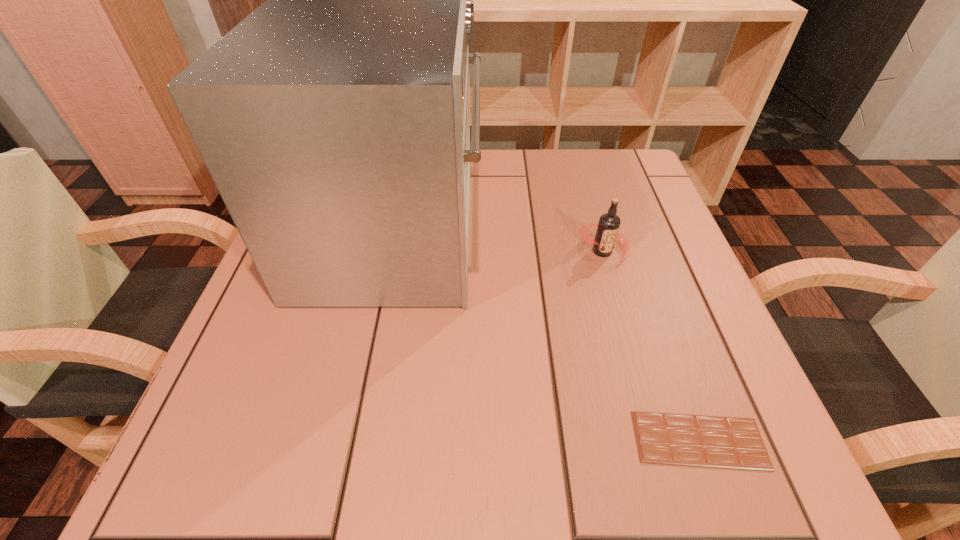
Locate an element on the screen. The height and width of the screenshot is (540, 960). the tallest object is located at coordinates (334, 120).

Find the location of `toaster oven`. toaster oven is located at coordinates (334, 120).

Locate an element on the screen. The height and width of the screenshot is (540, 960). root beer is located at coordinates (609, 223).

This screenshot has width=960, height=540. In order to click on chocolate bar in this screenshot , I will do `click(662, 438)`.

Image resolution: width=960 pixels, height=540 pixels. I want to click on the nearest object, so click(x=662, y=438).

The image size is (960, 540). Identify the location of free spot located on the front panel of the leftmost object. click(673, 234).

Where is `free space located on the label of the second tallest object`? Image resolution: width=960 pixels, height=540 pixels. free space located on the label of the second tallest object is located at coordinates (656, 437).

Identify the location of vacant space located 0.230m on the back of the shortest object. Image resolution: width=960 pixels, height=540 pixels. (647, 292).

Locate an element on the screen. The image size is (960, 540). object present at the far edge is located at coordinates (334, 120).

Locate an element on the screen. The height and width of the screenshot is (540, 960). object present at the near edge is located at coordinates (662, 438).